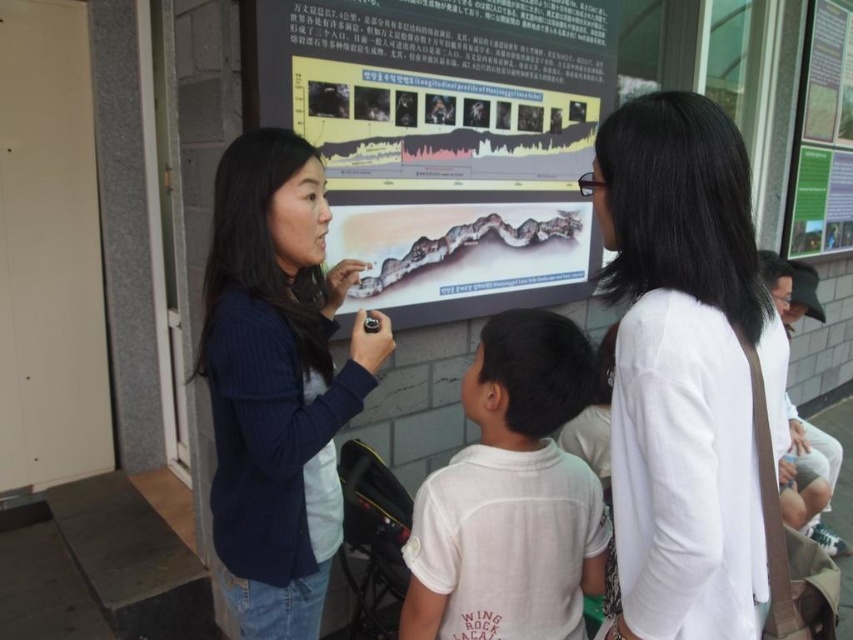
Question: Which object is closer to the camera taking this photo?

Choices:
 (A) green paper at upper right
 (B) navy blue sweater at center

Answer: (B)

Question: Can you confirm if white cotton shirt at center is positioned below green paper at upper right?

Choices:
 (A) no
 (B) yes

Answer: (B)

Question: In this image, where is white matte shirt at center located relative to white cotton shirt at center?

Choices:
 (A) right
 (B) left

Answer: (A)

Question: Estimate the real-world distances between objects in this image. Which object is farther from the matte plastic poster at center?

Choices:
 (A) green paper at upper right
 (B) white matte shirt at center

Answer: (A)

Question: Does navy blue sweater at center have a larger size compared to green paper at upper right?

Choices:
 (A) yes
 (B) no

Answer: (B)

Question: Which object is closer to the camera taking this photo?

Choices:
 (A) navy blue sweater at center
 (B) matte plastic poster at center
 (C) white cotton shirt at center
 (D) white matte shirt at center

Answer: (D)